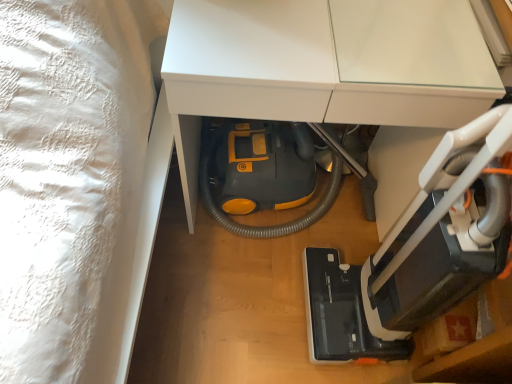
Question: Is yellow plastic vacuum cleaner at lower center positioned in front of black plastic vacuum cleaner at lower right?

Choices:
 (A) no
 (B) yes

Answer: (A)

Question: Considering the relative sizes of yellow plastic vacuum cleaner at lower center and black plastic vacuum cleaner at lower right in the image provided, is yellow plastic vacuum cleaner at lower center thinner than black plastic vacuum cleaner at lower right?

Choices:
 (A) no
 (B) yes

Answer: (A)

Question: Does yellow plastic vacuum cleaner at lower center appear on the right side of black plastic vacuum cleaner at lower right?

Choices:
 (A) no
 (B) yes

Answer: (A)

Question: Is black plastic vacuum cleaner at lower right inside yellow plastic vacuum cleaner at lower center?

Choices:
 (A) yes
 (B) no

Answer: (B)

Question: Considering the relative sizes of yellow plastic vacuum cleaner at lower center and black plastic vacuum cleaner at lower right in the image provided, is yellow plastic vacuum cleaner at lower center bigger than black plastic vacuum cleaner at lower right?

Choices:
 (A) no
 (B) yes

Answer: (B)

Question: From the image's perspective, is yellow plastic vacuum cleaner at lower center on black plastic vacuum cleaner at lower right?

Choices:
 (A) yes
 (B) no

Answer: (A)

Question: From the image's perspective, is black plastic vacuum cleaner at lower right on top of yellow plastic vacuum cleaner at lower center?

Choices:
 (A) yes
 (B) no

Answer: (B)

Question: Can you see black plastic vacuum cleaner at lower right touching yellow plastic vacuum cleaner at lower center?

Choices:
 (A) no
 (B) yes

Answer: (A)

Question: Considering the relative positions of black plastic vacuum cleaner at lower right and yellow plastic vacuum cleaner at lower center in the image provided, is black plastic vacuum cleaner at lower right to the right of yellow plastic vacuum cleaner at lower center from the viewer's perspective?

Choices:
 (A) no
 (B) yes

Answer: (B)

Question: Is yellow plastic vacuum cleaner at lower center at the back of black plastic vacuum cleaner at lower right?

Choices:
 (A) yes
 (B) no

Answer: (B)

Question: Can you confirm if black plastic vacuum cleaner at lower right is positioned to the left of yellow plastic vacuum cleaner at lower center?

Choices:
 (A) yes
 (B) no

Answer: (B)

Question: Considering the relative sizes of black plastic vacuum cleaner at lower right and yellow plastic vacuum cleaner at lower center in the image provided, is black plastic vacuum cleaner at lower right shorter than yellow plastic vacuum cleaner at lower center?

Choices:
 (A) yes
 (B) no

Answer: (B)

Question: Looking at the image, does yellow plastic vacuum cleaner at lower center seem bigger or smaller compared to black plastic vacuum cleaner at lower right?

Choices:
 (A) big
 (B) small

Answer: (A)